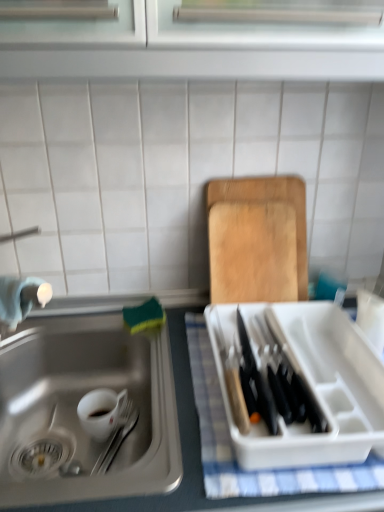
Identify the location of vacant region above white checkered cloth at right (from a real-world perspective). (326, 362).